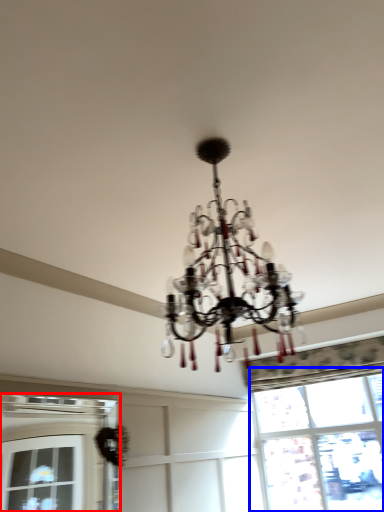
Question: Which point is further to the camera, window (highlighted by a red box) or window (highlighted by a blue box)?

Choices:
 (A) window
 (B) window

Answer: (B)